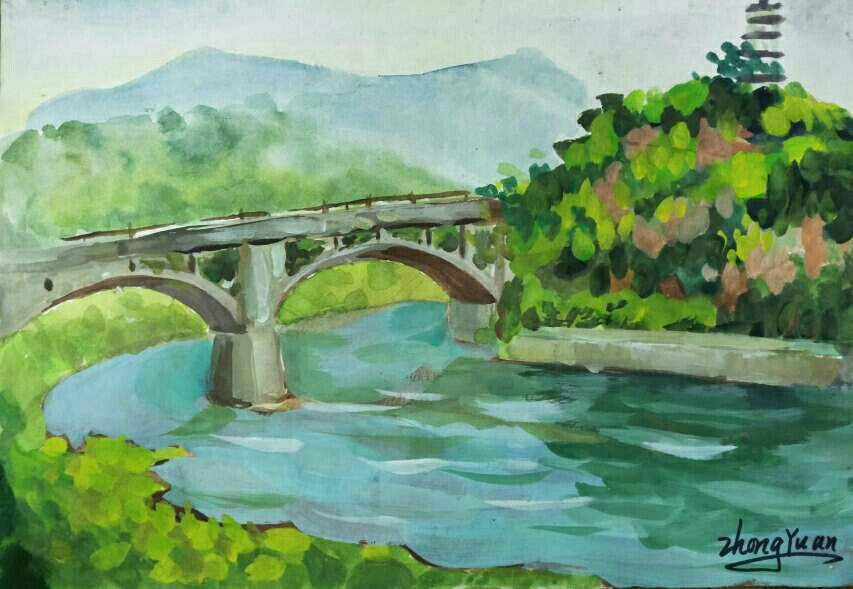
Where is `arch`? This screenshot has height=589, width=853. arch is located at coordinates (106, 287), (415, 257).